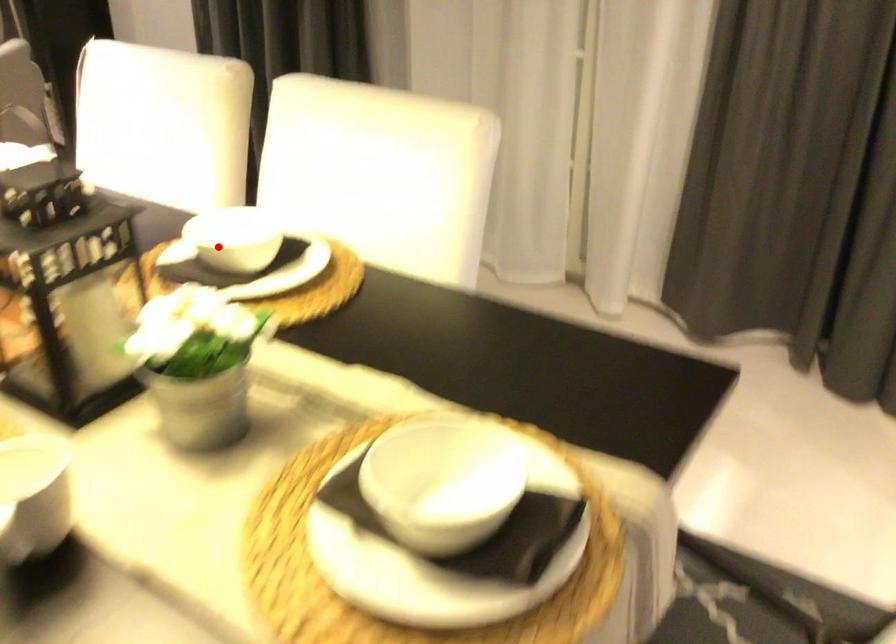
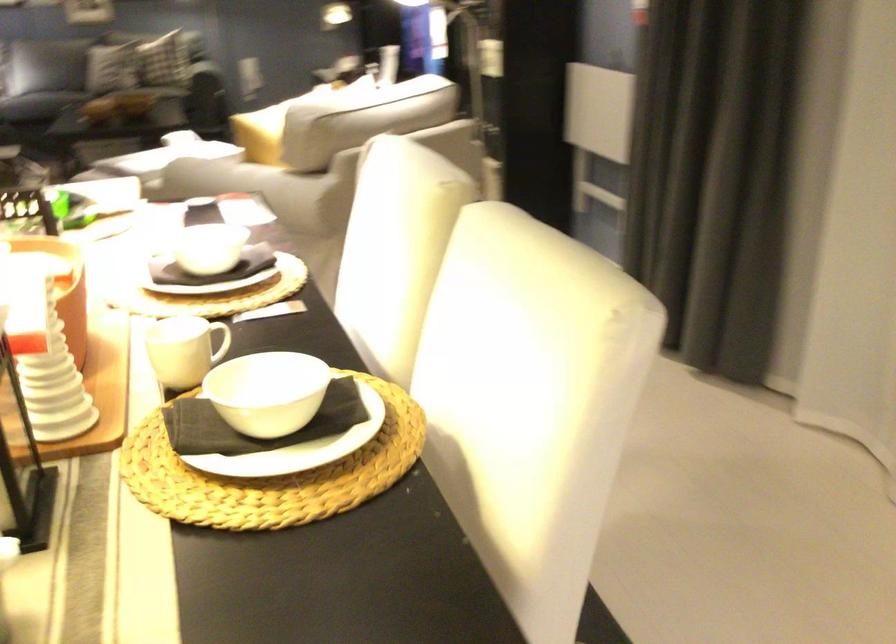
Question: I am providing you with two images of the same scene from different viewpoints. Image1 has a red point marked. In image2, the corresponding 3D location appears at what relative position? Reply with the corresponding letter.

Choices:
 (A) Closer
 (B) Farther

Answer: (A)